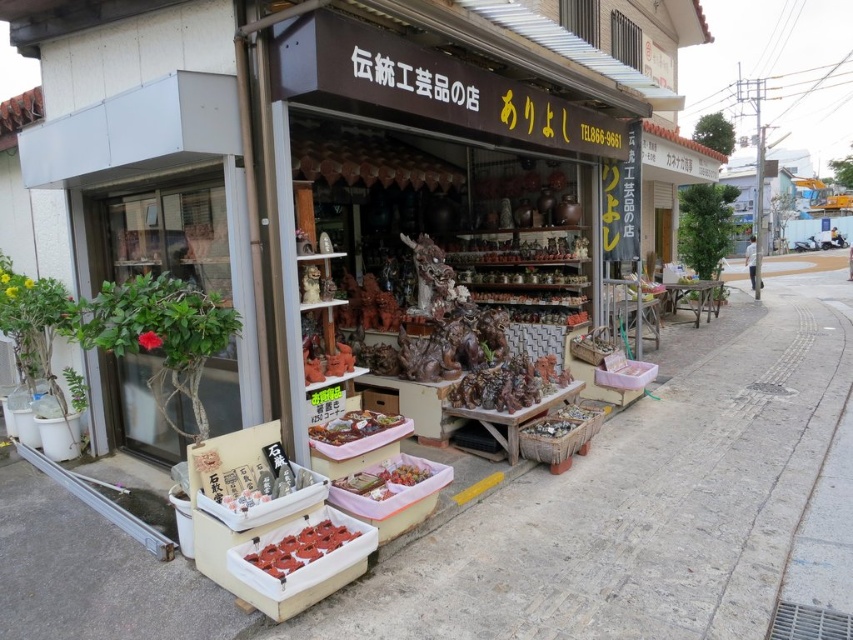
Question: Which of the following is the farthest from the observer?

Choices:
 (A) matte red donuts at lower center
 (B) smooth pink plastic food at center
 (C) green leafy plant at left

Answer: (C)

Question: Can you confirm if brown wooden statue at center is wider than matte red donuts at lower center?

Choices:
 (A) yes
 (B) no

Answer: (A)

Question: Among these objects, which one is farthest from the camera?

Choices:
 (A) brown wooden statue at center
 (B) matte red donuts at lower center

Answer: (A)

Question: Does green leafy plant at left appear on the right side of white matte stone at lower center?

Choices:
 (A) yes
 (B) no

Answer: (B)

Question: Among these objects, which one is nearest to the camera?

Choices:
 (A) shiny brown food at center
 (B) smooth concrete pavement at lower center
 (C) brown wooden statue at center
 (D) smooth pink plastic food at center

Answer: (B)

Question: Is smooth pink plastic food at center to the right of white matte stone at lower center from the viewer's perspective?

Choices:
 (A) yes
 (B) no

Answer: (A)